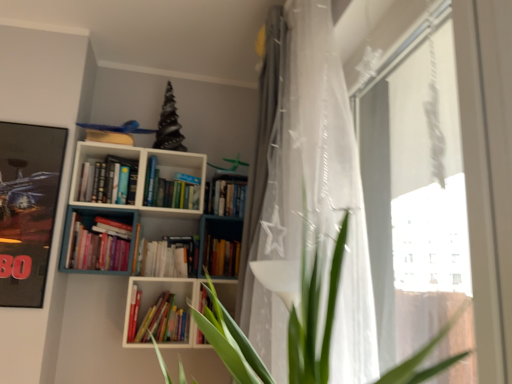
Question: From a real-world perspective, is white sheer curtain at center, the second curtain viewed from the back, on white matte bookcase at upper center?

Choices:
 (A) no
 (B) yes

Answer: (B)

Question: Considering the relative sizes of white sheer curtain at center, the second curtain viewed from the back, and white matte bookcase at upper center in the image provided, is white sheer curtain at center, the second curtain viewed from the back, bigger than white matte bookcase at upper center?

Choices:
 (A) no
 (B) yes

Answer: (A)

Question: Can you confirm if white sheer curtain at center, placed as the 1th curtain when sorted from front to back, is thinner than white matte bookcase at upper center?

Choices:
 (A) yes
 (B) no

Answer: (A)

Question: Can you confirm if white sheer curtain at center, placed as the 1th curtain when sorted from front to back, is shorter than white matte bookcase at upper center?

Choices:
 (A) no
 (B) yes

Answer: (A)

Question: Is white sheer curtain at center, the second curtain viewed from the back, completely or partially outside of white matte bookcase at upper center?

Choices:
 (A) yes
 (B) no

Answer: (A)

Question: Looking at their shapes, would you say hardcover book at center, the 2th book positioned from the bottom, is wider or thinner than transparent plastic curtain at right?

Choices:
 (A) thin
 (B) wide

Answer: (B)

Question: Is hardcover book at center, which is the first book from right to left, inside or outside of transparent plastic curtain at right?

Choices:
 (A) inside
 (B) outside

Answer: (B)

Question: Is point 217,246 positioned closer to the camera than point 437,168?

Choices:
 (A) farther
 (B) closer

Answer: (A)

Question: In terms of height, does hardcover book at center, which is the first book from right to left, look taller or shorter compared to transparent plastic curtain at right?

Choices:
 (A) tall
 (B) short

Answer: (B)

Question: From the image's perspective, relative to white matte bookcase at upper center, is white sheer curtain at center, the second curtain viewed from the back, above or below?

Choices:
 (A) above
 (B) below

Answer: (A)

Question: Considering the positions of point (364, 339) and point (139, 210), is point (364, 339) closer or farther from the camera than point (139, 210)?

Choices:
 (A) closer
 (B) farther

Answer: (A)

Question: From a real-world perspective, is white sheer curtain at center, placed as the 1th curtain when sorted from front to back, above or below white matte bookcase at upper center?

Choices:
 (A) below
 (B) above

Answer: (B)

Question: Based on their sizes in the image, would you say white sheer curtain at center, placed as the 1th curtain when sorted from front to back, is bigger or smaller than white matte bookcase at upper center?

Choices:
 (A) small
 (B) big

Answer: (A)

Question: Is transparent plastic curtain at right spatially inside white sheer curtain at upper center, the second curtain in the front-to-back sequence, or outside of it?

Choices:
 (A) inside
 (B) outside

Answer: (B)

Question: From the image's perspective, is transparent plastic curtain at right above or below white sheer curtain at upper center, the second curtain in the front-to-back sequence?

Choices:
 (A) below
 (B) above

Answer: (A)